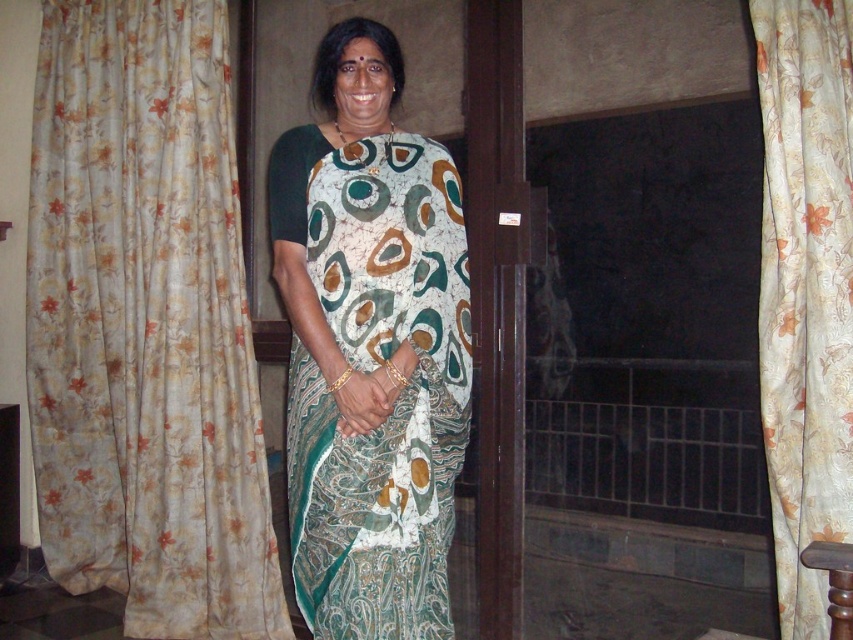
Question: Which point is closer to the camera taking this photo?

Choices:
 (A) (114, 307)
 (B) (811, 573)
 (C) (392, 412)

Answer: (B)

Question: Can you confirm if floral fabric curtain at left is positioned above printed silk saree at center?

Choices:
 (A) no
 (B) yes

Answer: (B)

Question: Does floral fabric curtain at left have a smaller size compared to printed silk saree at center?

Choices:
 (A) no
 (B) yes

Answer: (A)

Question: Which of the following is the farthest from the observer?

Choices:
 (A) floral fabric curtain at left
 (B) floral silk curtain at right
 (C) printed silk saree at center

Answer: (A)

Question: Which of the following is the closest to the observer?

Choices:
 (A) printed silk saree at center
 (B) floral silk curtain at right

Answer: (B)

Question: From the image, what is the correct spatial relationship of printed silk saree at center in relation to floral silk curtain at right?

Choices:
 (A) left
 (B) right

Answer: (A)